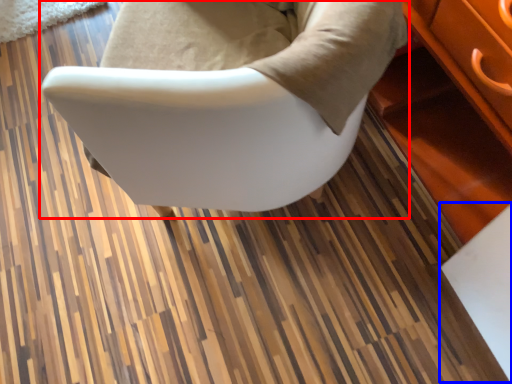
Question: Which object is closer to the camera taking this photo, chair (highlighted by a red box) or table (highlighted by a blue box)?

Choices:
 (A) chair
 (B) table

Answer: (A)